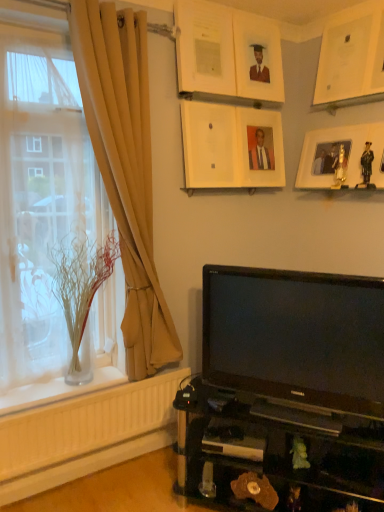
Where is `free space above white matte picture frame at upper center, acting as the fifth picture frame starting from the right (from a real-world perspective)`? The width and height of the screenshot is (384, 512). free space above white matte picture frame at upper center, acting as the fifth picture frame starting from the right (from a real-world perspective) is located at coordinates (208, 101).